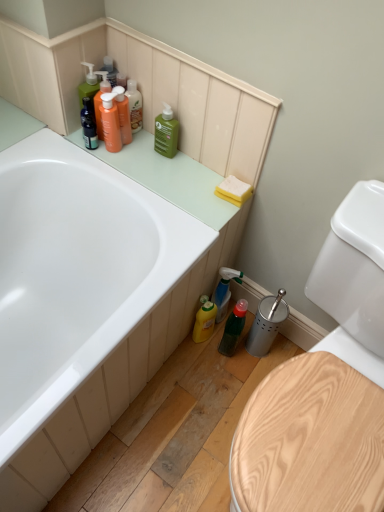
At what (x,y) coordinates should I click in order to perform the action: click on free space that is in between yellow sponge at upper right and translucent orange bottle at upper left, acting as the 4th cleaning product starting from the bottom. Please return your answer as a coordinate pair (x, y). This screenshot has height=512, width=384. Looking at the image, I should click on (187, 167).